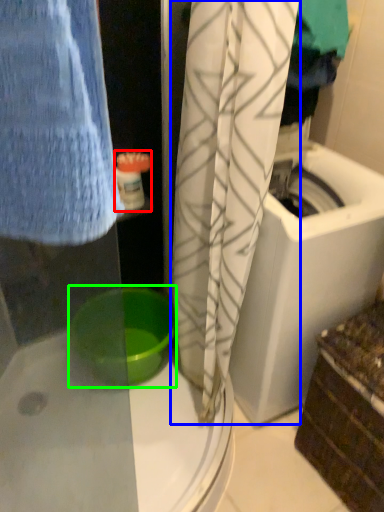
Question: Considering the real-world distances, which object is farthest from toiletry (highlighted by a red box)? curtain (highlighted by a blue box) or basin (highlighted by a green box)?

Choices:
 (A) curtain
 (B) basin

Answer: (B)